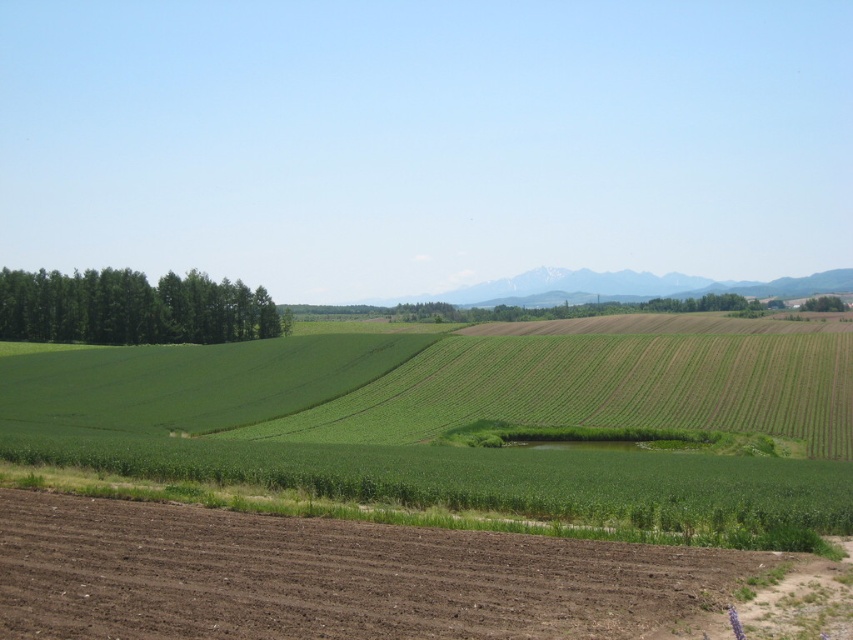
You are standing at the point marked by the coordinates point (463,381) in the image. Looking around, you see the freshly plowed field with dark brown soil in the foreground and the green grassy field at center. Which direction should you walk to reach the freshly plowed field with dark brown soil?

Since you are at the point (463,381) which marks the green grassy field at center, you should walk towards the foreground direction to reach the freshly plowed field with dark brown soil.

You are standing at the edge of the brown soil at lower left and want to look over to the green leafy tree at right. Considering their heights, will you need to crouch down or stand up straight to get a better view?

The brown soil at lower left has a lesser height compared to the green leafy tree at right, so you would need to stand up straight to get a better view since the tree is taller.

You are a farmer who wants to plant new crops in the green grassy field at center and green leafy trees at left. Based on the scene, which area has more space available for planting?

The green grassy field at center has more space available for planting because its width is larger than the green leafy trees at left.